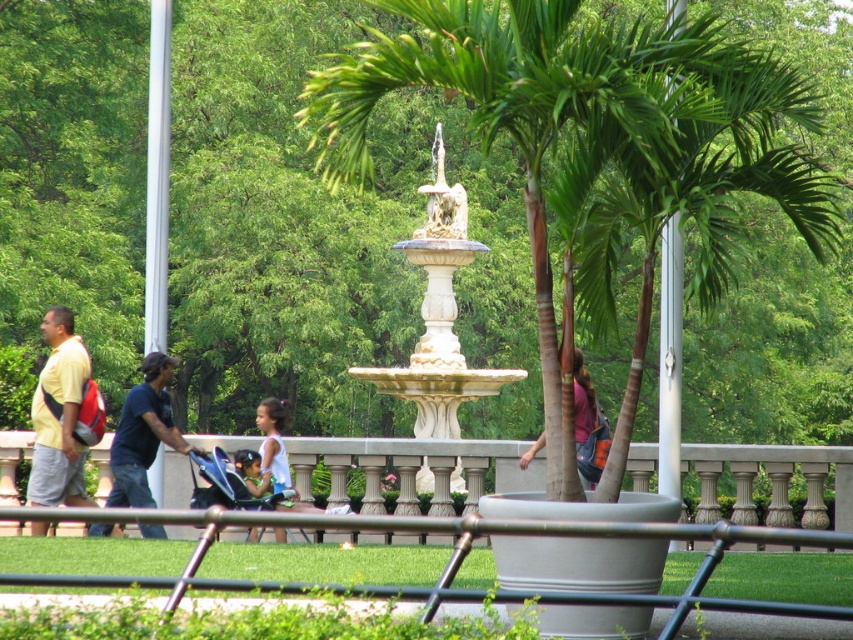
Which is in front, point (357, 378) or point (73, 412)?

Point (73, 412) is more forward.

Consider the image. Is white stone fountain at center to the left of yellow matte shirt at left from the viewer's perspective?

No, white stone fountain at center is not to the left of yellow matte shirt at left.

Is point (426, 412) farther from camera compared to point (49, 426)?

Yes, it is.

Find the location of a particular element. The image size is (853, 640). white stone fountain at center is located at coordinates (438, 316).

Does white stone fountain at center appear under dark blue t-shirt at center?

No, white stone fountain at center is not below dark blue t-shirt at center.

Between point (433, 358) and point (166, 401), which one is positioned in front?

Point (166, 401) is more forward.

Locate an element on the screen. The width and height of the screenshot is (853, 640). white stone fountain at center is located at coordinates (438, 316).

Does yellow matte shirt at left appear under dark blue t-shirt at center?

Actually, yellow matte shirt at left is above dark blue t-shirt at center.

Does yellow matte shirt at left have a larger size compared to dark blue t-shirt at center?

Correct, yellow matte shirt at left is larger in size than dark blue t-shirt at center.

Between point (41, 416) and point (107, 532), which one is positioned behind?

The point (41, 416) is more distant.

Where is `yellow matte shirt at left`? Image resolution: width=853 pixels, height=640 pixels. yellow matte shirt at left is located at coordinates (59, 417).